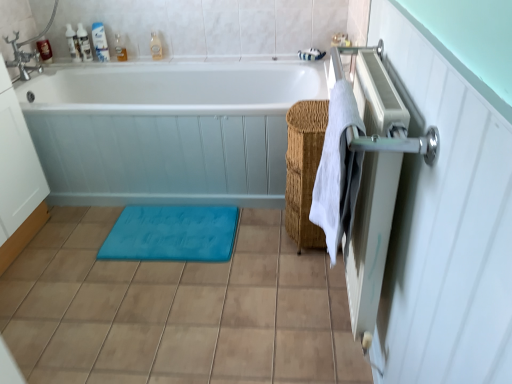
The height and width of the screenshot is (384, 512). I want to click on vacant area situated below blue rubber bath mat at center (from a real-world perspective), so click(173, 227).